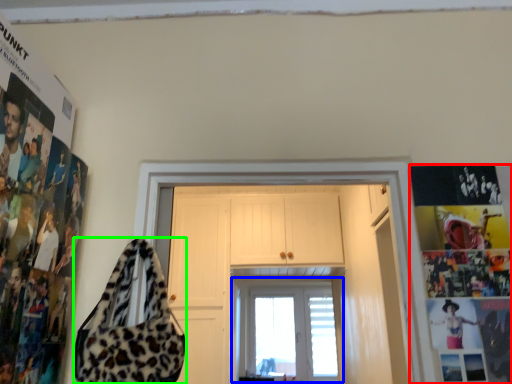
Question: Considering the real-world distances, which object is farthest from poster page (highlighted by a red box)? window (highlighted by a blue box) or shoulder bag (highlighted by a green box)?

Choices:
 (A) window
 (B) shoulder bag

Answer: (A)